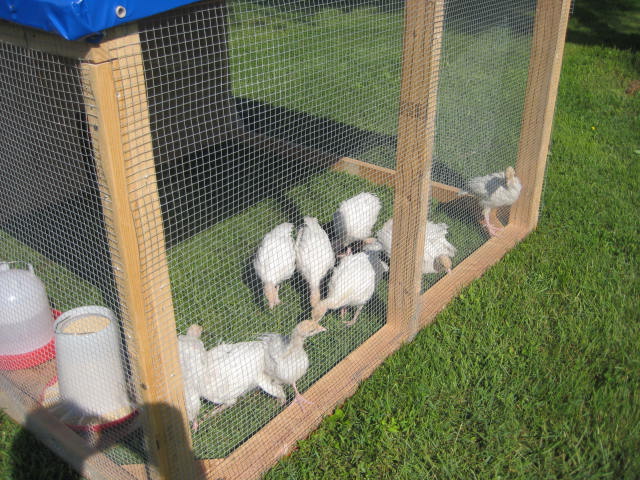
The image size is (640, 480). I want to click on wood post, so click(x=156, y=441).